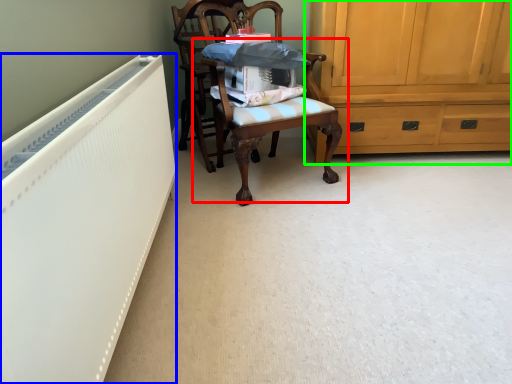
Question: Which is farther away from chair (highlighted by a red box)? radiator (highlighted by a blue box) or cabinetry (highlighted by a green box)?

Choices:
 (A) radiator
 (B) cabinetry

Answer: (A)